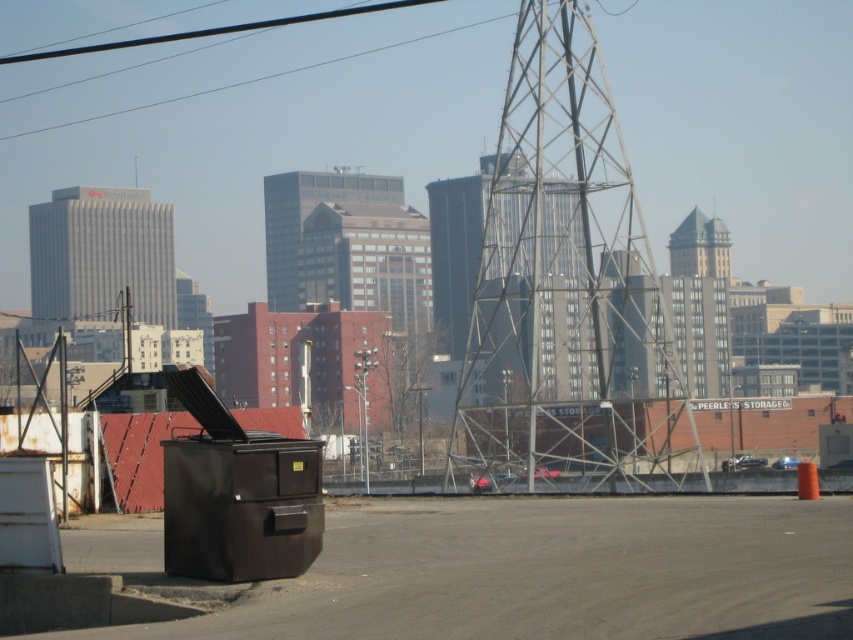
Does gray concrete skyscraper at center have a lesser width compared to black wire at upper center?

Yes.

The height and width of the screenshot is (640, 853). What do you see at coordinates (102, 256) in the screenshot? I see `gray concrete skyscraper at center` at bounding box center [102, 256].

This screenshot has width=853, height=640. Find the location of `gray concrete skyscraper at center`. gray concrete skyscraper at center is located at coordinates (102, 256).

Can you confirm if gray concrete skyscraper at center is smaller than green glass tower at upper center?

Incorrect, gray concrete skyscraper at center is not smaller in size than green glass tower at upper center.

The image size is (853, 640). Describe the element at coordinates (102, 256) in the screenshot. I see `gray concrete skyscraper at center` at that location.

Where is `gray concrete skyscraper at center`? Image resolution: width=853 pixels, height=640 pixels. gray concrete skyscraper at center is located at coordinates (102, 256).

Who is positioned more to the left, green glass tower at upper center or black wire at upper center?

black wire at upper center

Is green glass tower at upper center taller than black wire at upper center?

No, green glass tower at upper center is not taller than black wire at upper center.

Is point (701, 269) behind point (38, 129)?

No, it is in front of (38, 129).

This screenshot has height=640, width=853. I want to click on green glass tower at upper center, so click(699, 246).